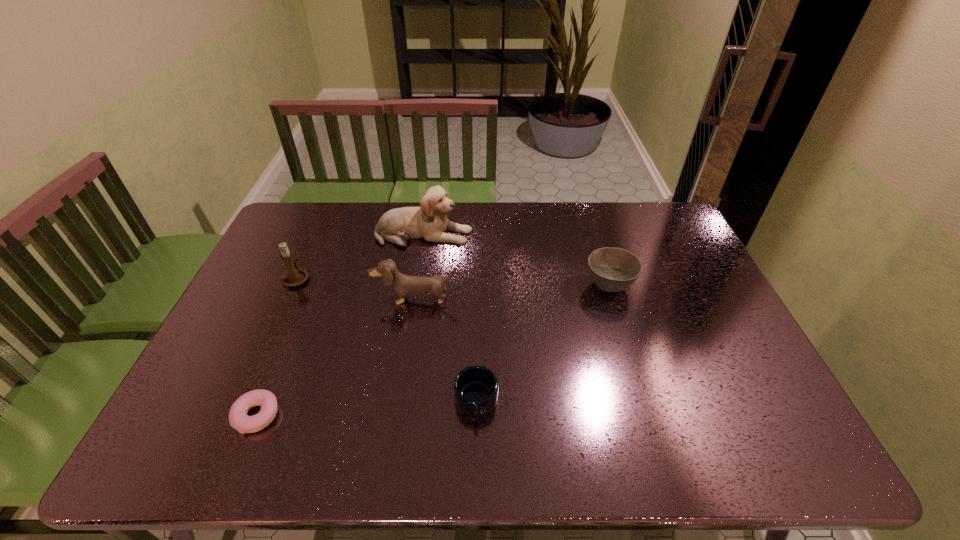
You are a GUI agent. You are given a task and a screenshot of the screen. Output one action in this format:
    pyautogui.click(x=<x>, y=<y>)
    Task: Click on the object positioned at the near left corner
    
    Given the screenshot: What is the action you would take?
    pyautogui.click(x=238, y=418)

Find the location of a particular element. free space at the far edge of the desktop is located at coordinates tap(516, 227).

This screenshot has height=540, width=960. I want to click on free space at the near edge of the desktop, so click(356, 433).

The image size is (960, 540). I want to click on vacant region at the left edge, so click(233, 325).

Identify the location of vacant area at the right edge. This screenshot has height=540, width=960. (662, 251).

Where is `vacant space at the far right corner`? Image resolution: width=960 pixels, height=540 pixels. vacant space at the far right corner is located at coordinates (674, 213).

The width and height of the screenshot is (960, 540). What are the coordinates of `free spot between the doughnut and the shorter puppy` in the screenshot? It's located at point(336,357).

At what (x,y) coordinates should I click in order to perform the action: click on free spot between the candle holder and the farther puppy. Please return your answer as a coordinate pair (x, y). Looking at the image, I should click on (360, 256).

At what (x,y) coordinates should I click in order to perform the action: click on empty space between the nearer puppy and the farther puppy. Please return your answer as a coordinate pair (x, y). Looking at the image, I should click on (420, 266).

The width and height of the screenshot is (960, 540). I want to click on vacant space that's between the shortest object and the taller puppy, so click(x=341, y=325).